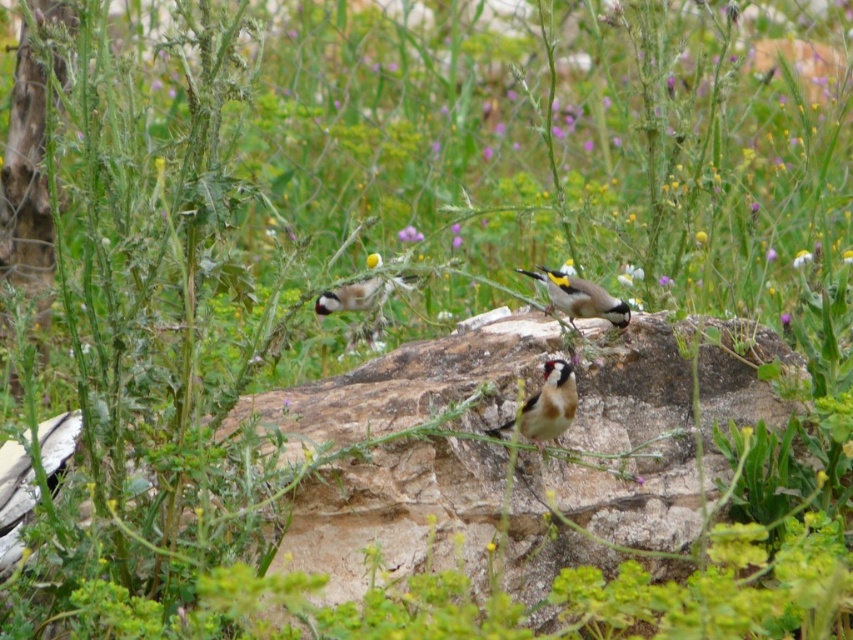
You are a photographer standing at the edge of a rocky area where there is a purple matte flower at center. You want to capture a closeup shot of the flower. Do you need to move closer than 25 feet to get the shot?

The purple matte flower at center is 25.54 feet away from the camera. To capture a closeup shot, you would need to move closer than 25.54 feet, so moving closer than 25 feet would be sufficient.